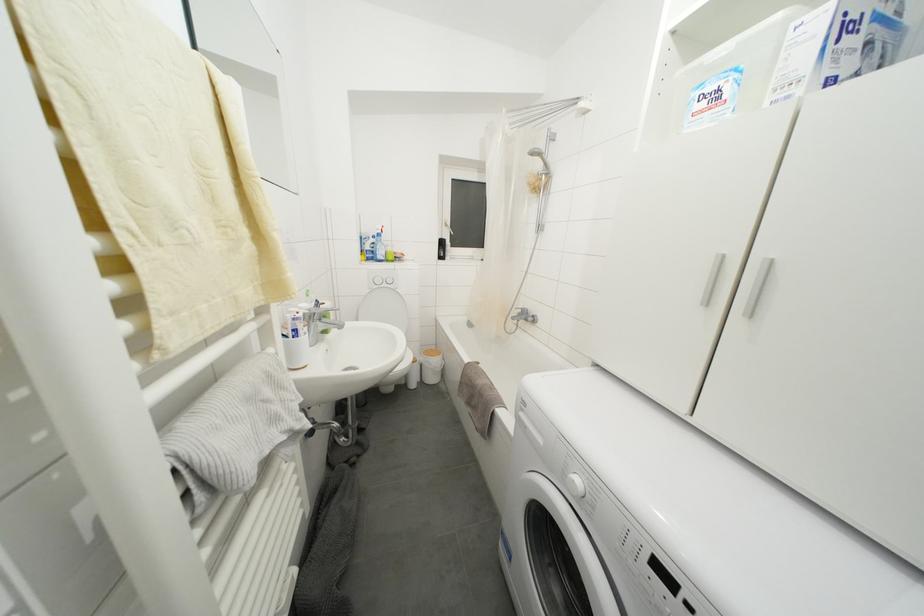
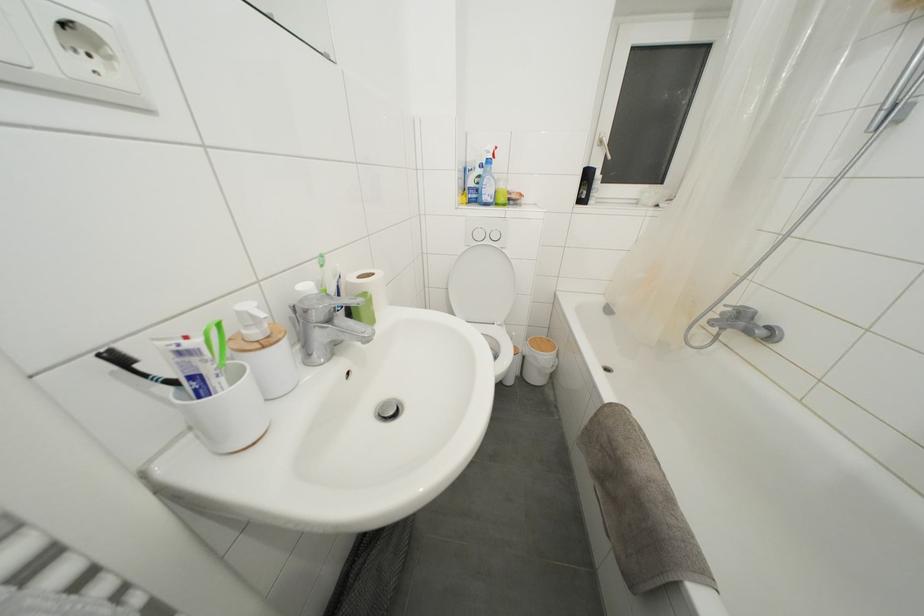
Where in the second image is the point corresponding to (398,294) from the first image?

(505, 256)